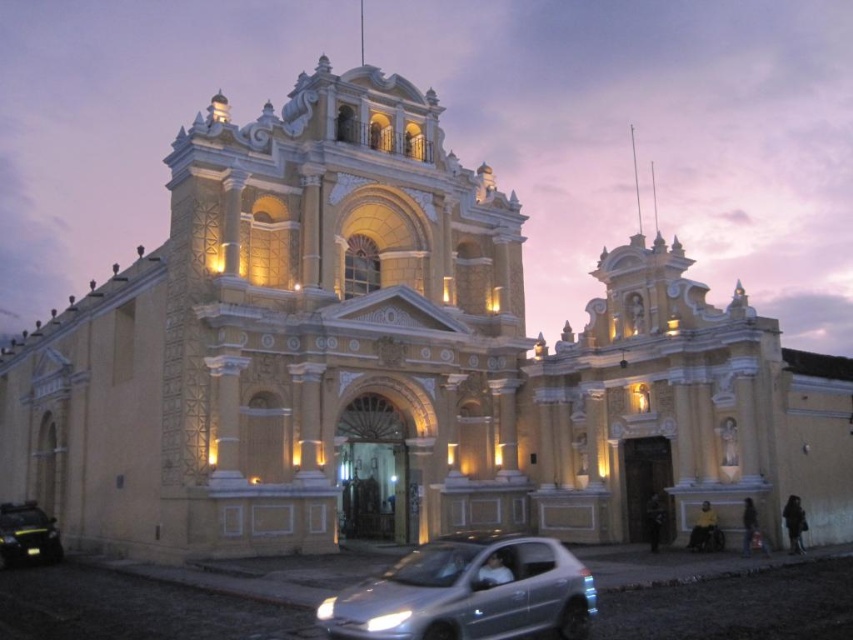
Between silver metallic car at lower center and metallic silver car at lower left, which one appears on the right side from the viewer's perspective?

Positioned to the right is silver metallic car at lower center.

Between point (469, 604) and point (62, 554), which one is positioned in front?

Positioned in front is point (469, 604).

At what (x,y) coordinates should I click in order to perform the action: click on silver metallic car at lower center. Please return your answer as a coordinate pair (x, y). The height and width of the screenshot is (640, 853). Looking at the image, I should click on (468, 593).